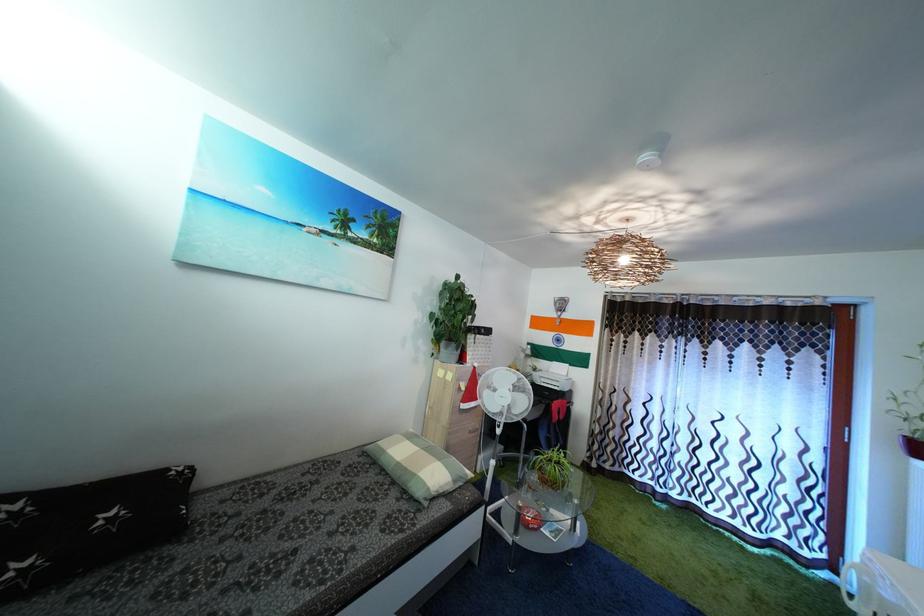
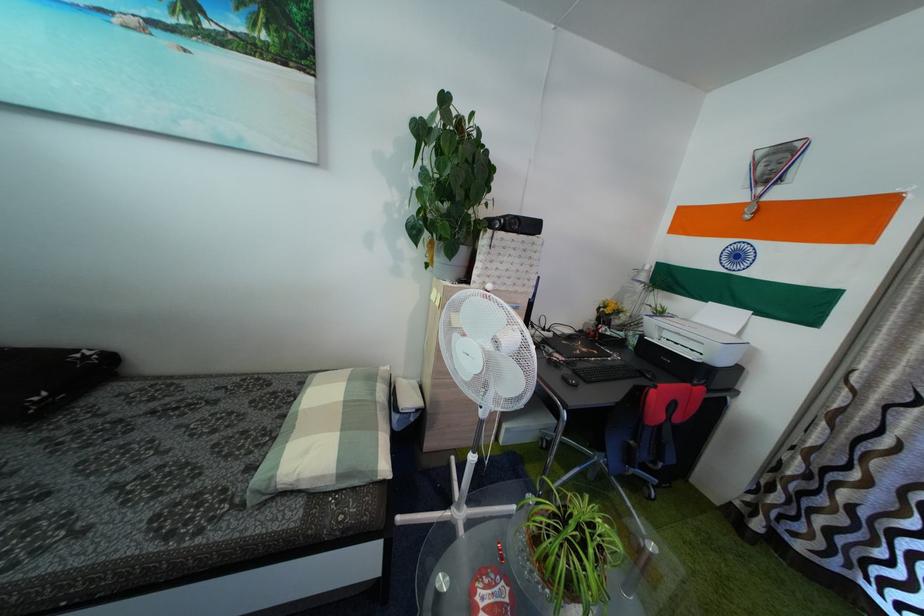
In the second image, find the point that corresponds to point 441,362 in the first image.

(435, 273)